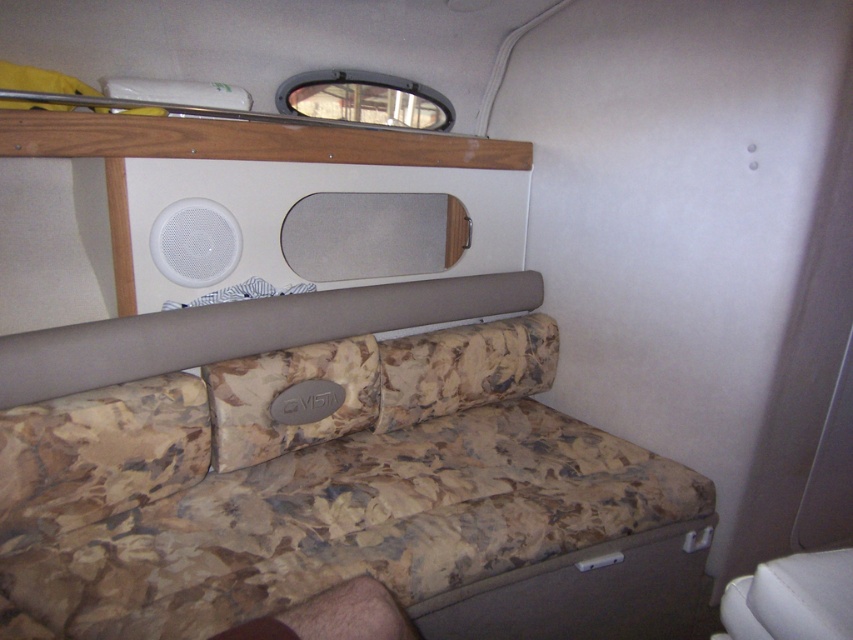
You are standing at the point labeled point (x=479, y=387). You need to reach the bunk bed in the upper left corner. The space between you and the bunk bed is 2.33 meters. If your wheelchair has a turning radius of 1.5 meters, can you maneuver safely to the bunk bed without touching any obstacles?

The distance between point (x=479, y=387) and the bunk bed is 2.33 meters. Since the wheelchair requires a turning radius of 1.5 meters, which is less than the available space, you can maneuver safely to the bunk bed without touching any obstacles.

You are a guest in this RV and want to place your phone on the closest object to you. You are currently facing the camouflage fabric pillow at center and the white plastic speaker at upper left. Which object should you choose?

The camouflage fabric pillow at center is positioned under the white plastic speaker at upper left, so the closest object to you would be the camouflage fabric pillow at center since it is directly below the speaker.